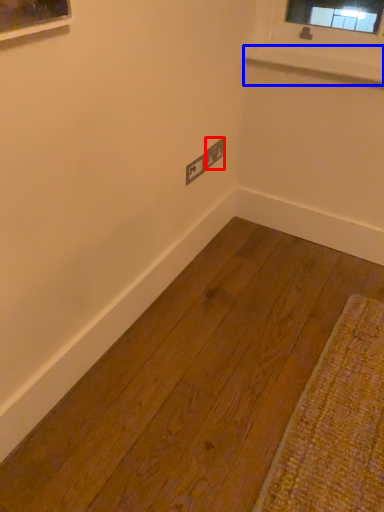
Question: Which of the following is the farthest to the observer, electric outlet (highlighted by a red box) or window sill (highlighted by a blue box)?

Choices:
 (A) electric outlet
 (B) window sill

Answer: (A)